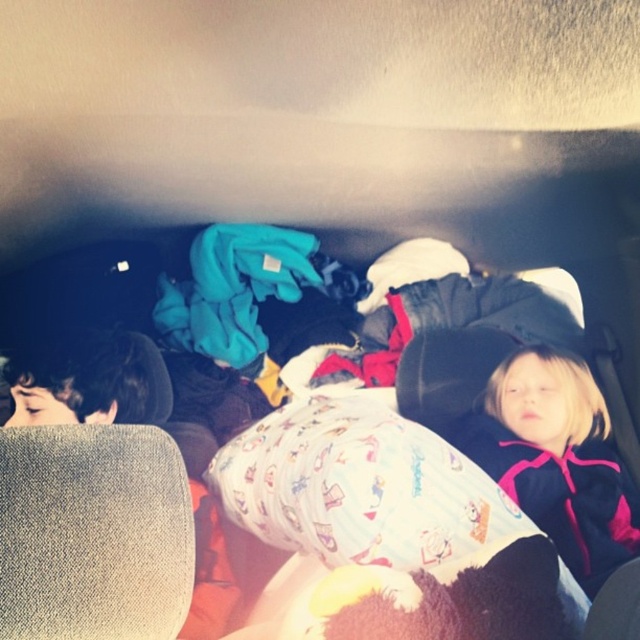
Question: Which of these objects is positioned closest to the pink fleece jacket at right?

Choices:
 (A) white cotton bed at center
 (B) dark brown hair at left

Answer: (A)

Question: Which point is closer to the camera taking this photo?

Choices:
 (A) (545, 512)
 (B) (90, 416)
 (C) (451, 353)

Answer: (A)

Question: Does white cotton bed at center appear over dark brown hair at left?

Choices:
 (A) no
 (B) yes

Answer: (B)

Question: Where is pink fleece jacket at right located in relation to dark brown hair at left in the image?

Choices:
 (A) right
 (B) left

Answer: (A)

Question: Is white cotton bed at center to the right of pink fleece jacket at right from the viewer's perspective?

Choices:
 (A) no
 (B) yes

Answer: (A)

Question: Among these points, which one is nearest to the camera?

Choices:
 (A) (605, 500)
 (B) (244, 332)
 (C) (154, 387)

Answer: (A)